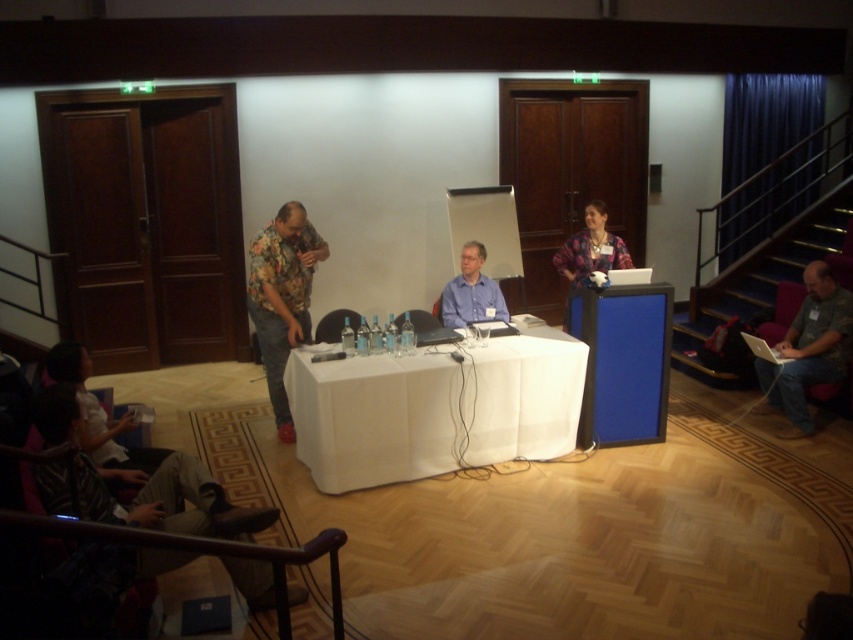
You are organizing a small event and need to place a 10 cm tall decorative vase on the table. Given the height difference between the white fabric table at center and the patterned fabric shirt at center, will the vase be visible from the front of the room?

The white fabric table at center is taller than the patterned fabric shirt at center. Since the vase is only 10 cm tall, it will be visible from the front of the room as it can be placed on the taller table.

Based on the photo, you are an attendee in the conference room and want to get the attention of the person in the striped fabric shirt at lower left. Since you can only approach from the back, will you have to walk around the floral shirt at center to reach them?

The striped fabric shirt at lower left is in front of floral shirt at center, so you would need to walk around the floral shirt at center to reach the striped fabric shirt at lower left from behind.